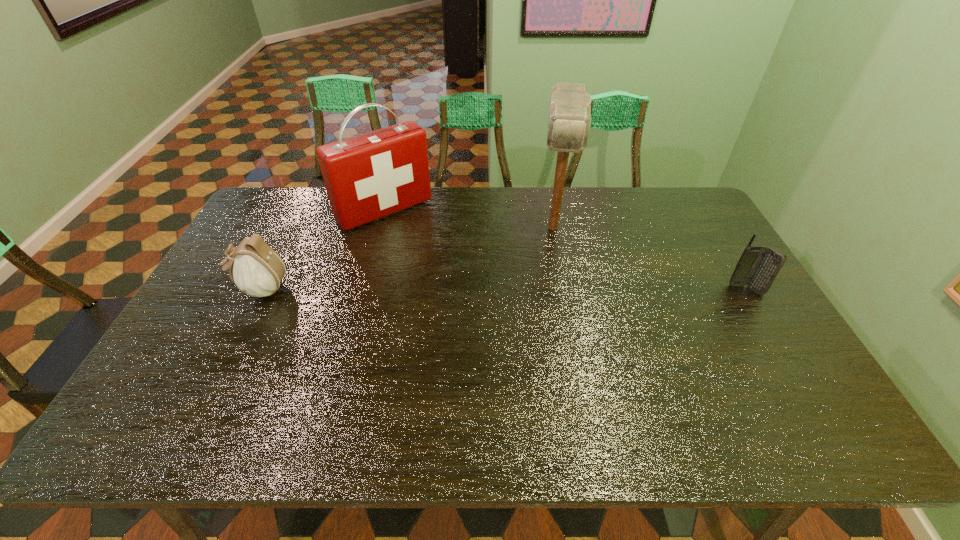
I want to click on free space located on the front face of the third object from right to left, so click(x=428, y=251).

Find the location of a particular element. This screenshot has width=960, height=540. free space located 0.210m on the front face of the third object from right to left is located at coordinates (440, 263).

Find the location of a particular element. vacant region located 0.330m on the front face of the third object from right to left is located at coordinates (461, 286).

Identify the location of mallet located in the far edge section of the desktop. (569, 119).

This screenshot has height=540, width=960. I want to click on the first-aid kit positioned at the far edge, so click(x=369, y=176).

Find the location of a particular element. Image resolution: width=960 pixels, height=540 pixels. object that is at the left edge is located at coordinates (256, 269).

I want to click on object that is at the right edge, so click(x=757, y=267).

At what (x,y) coordinates should I click in order to perform the action: click on vacant area at the far edge of the desktop. Please return your answer as a coordinate pair (x, y). The height and width of the screenshot is (540, 960). Looking at the image, I should click on (646, 210).

In the image, there is a desktop. At what (x,y) coordinates should I click in order to perform the action: click on vacant space at the near edge. Please return your answer as a coordinate pair (x, y). Image resolution: width=960 pixels, height=540 pixels. Looking at the image, I should click on (541, 380).

In the image, there is a desktop. In order to click on vacant space at the left edge in this screenshot , I will do `click(261, 236)`.